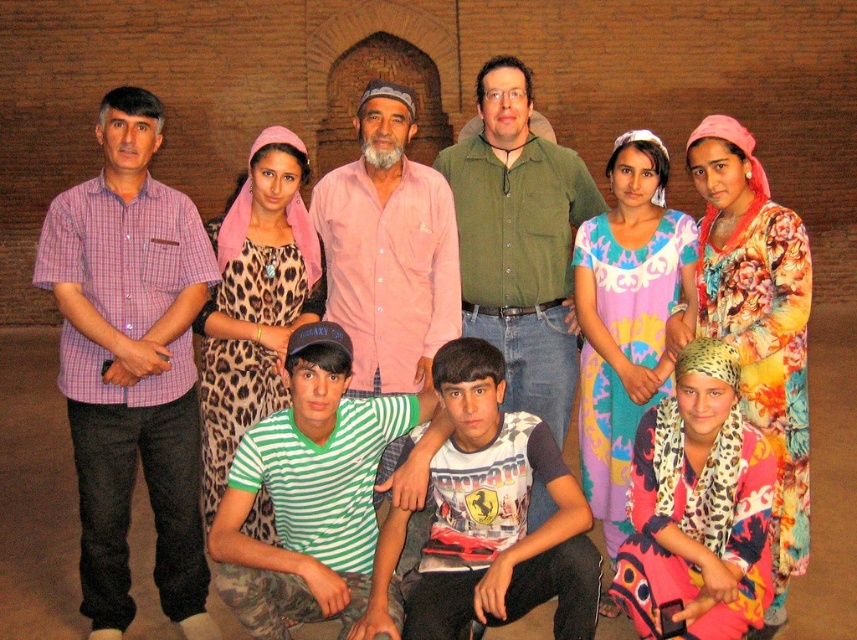
Can you confirm if plaid cotton shirt at left is shorter than pink cotton shirt at center?

No.

What do you see at coordinates (130, 364) in the screenshot? Image resolution: width=857 pixels, height=640 pixels. I see `plaid cotton shirt at left` at bounding box center [130, 364].

At what (x,y) coordinates should I click in order to perform the action: click on plaid cotton shirt at left. Please return your answer as a coordinate pair (x, y). Looking at the image, I should click on (130, 364).

Locate an element on the screen. The height and width of the screenshot is (640, 857). green striped shirt at center is located at coordinates (309, 492).

Does green striped shirt at center appear under white printed t-shirt at center?

No.

Is point (276, 584) positioned after point (502, 618)?

No, it is in front of (502, 618).

The height and width of the screenshot is (640, 857). What are the coordinates of `green striped shirt at center` in the screenshot? It's located at (309, 492).

Who is lower down, plaid cotton shirt at left or white printed t-shirt at center?

Positioned lower is white printed t-shirt at center.

How far apart are plaid cotton shirt at left and white printed t-shirt at center?

plaid cotton shirt at left and white printed t-shirt at center are 2.36 meters apart.

The height and width of the screenshot is (640, 857). I want to click on plaid cotton shirt at left, so click(130, 364).